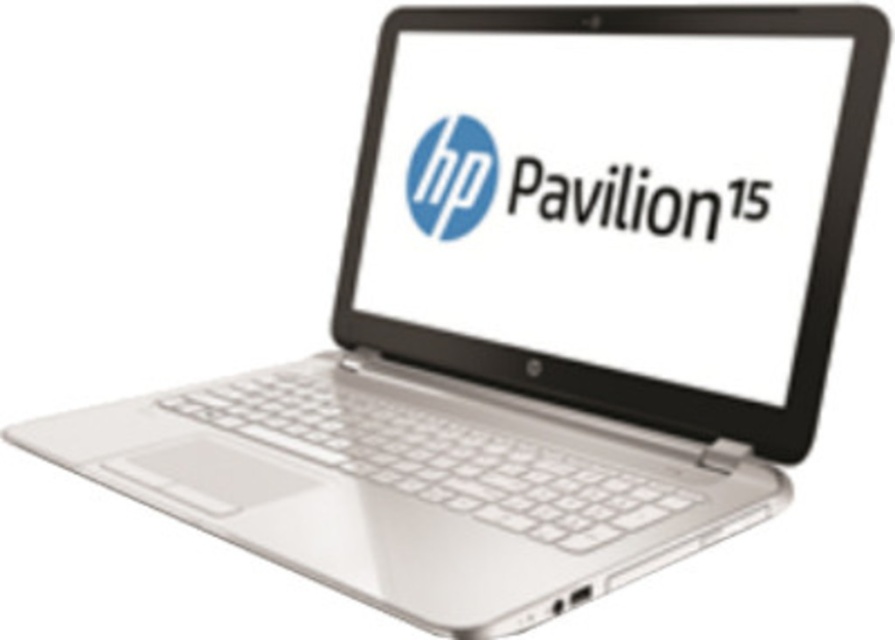
Question: Which point is farther to the camera?

Choices:
 (A) (450, 120)
 (B) (522, 156)
 (C) (573, 316)

Answer: (A)

Question: Is silver glossy laptop screen at center closer to camera compared to matte black laptop at center?

Choices:
 (A) yes
 (B) no

Answer: (A)

Question: Does silver glossy laptop screen at center have a lesser width compared to matte black laptop at center?

Choices:
 (A) yes
 (B) no

Answer: (B)

Question: Which of the following is the closest to the observer?

Choices:
 (A) (737, 362)
 (B) (470, 209)
 (C) (595, 208)

Answer: (A)

Question: Which of these objects is positioned closest to the matte plastic logo at center?

Choices:
 (A) matte black laptop at center
 (B) silver glossy laptop screen at center

Answer: (A)

Question: In this image, where is silver glossy laptop screen at center located relative to matte black laptop at center?

Choices:
 (A) left
 (B) right

Answer: (A)